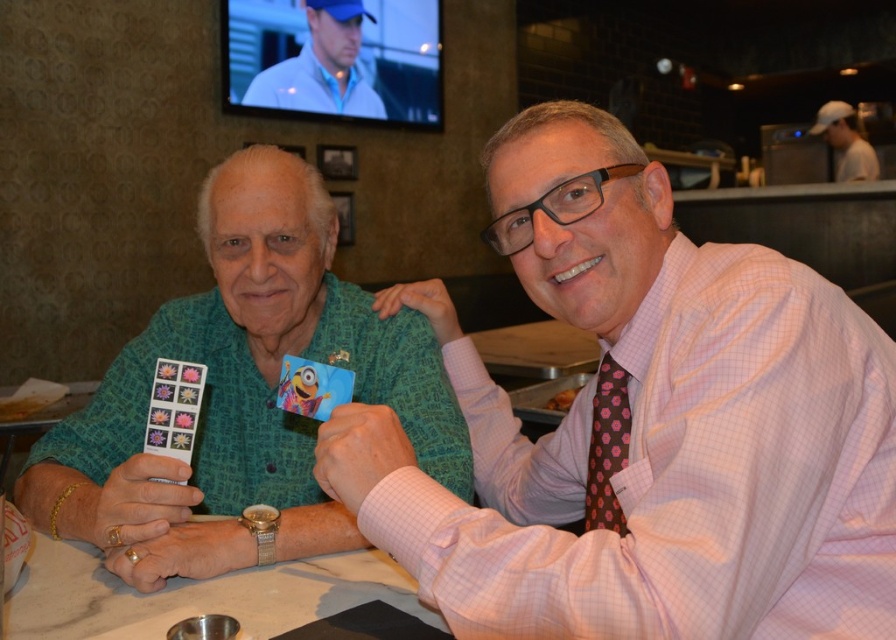
You are taking a photo of the two people at the table. Which of the two points, point (48, 572) or point (847, 125), will appear larger in the photo?

Point (48, 572) will appear larger in the photo because it is closer to the camera than point (847, 125).

You are a photographer trying to capture a clear shot of the white marble table at center and the white cap at upper right. Since both objects are white, you need to adjust your camera settings to ensure proper exposure. Which object should you focus on first to avoid overexposure?

The white marble table at center is positioned under the white cap at upper right, so focusing on the white cap at upper right first would help avoid overexposure as it might be reflecting more light.

You are a photographer trying to capture a closeup shot of both the green textured shirt at left and the pink floral silk tie at right. Given that your camera can only focus on objects within a 18 inch range, will you be able to capture both items in focus?

The green textured shirt at left is 19.05 inches from the pink floral silk tie at right, which is slightly beyond the camera focus range of 18 inches. Therefore, both items cannot be captured in focus simultaneously.